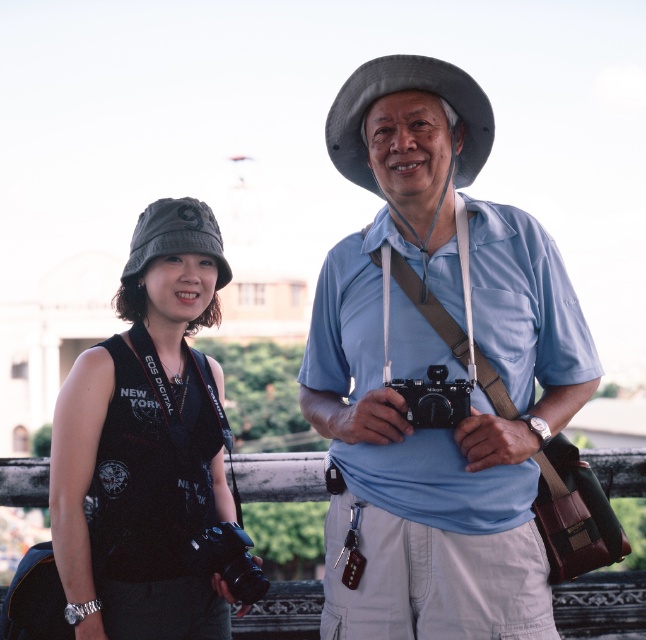
Based on the photo, you are a photographer trying to position your camera exactly at the center of the frame. Given the gray fabric cowboy hat at center is located at coordinates point 0.142, 0.622, can you determine if your camera is positioned correctly?

The gray fabric cowboy hat at center is located at point (401, 90), so the camera is positioned correctly at the center of the frame.